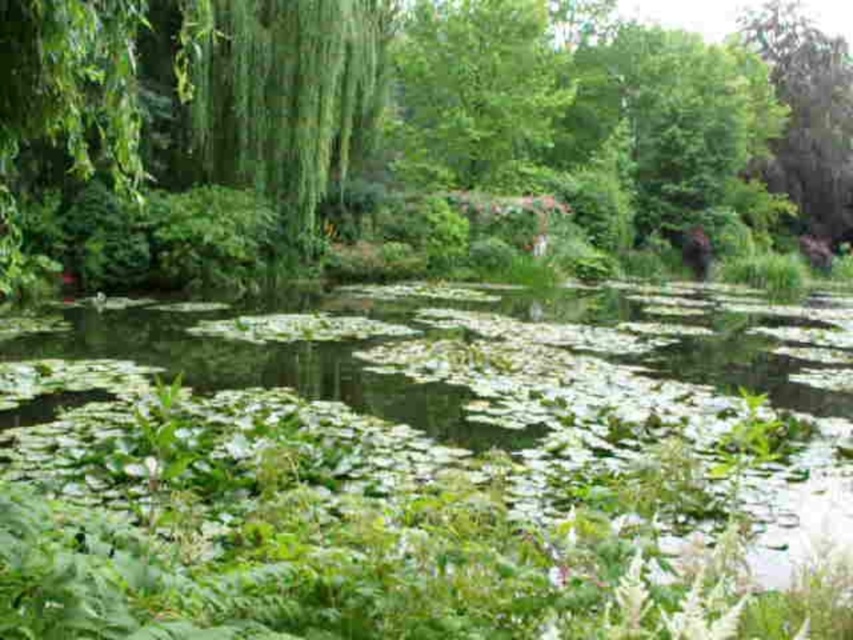
Who is more forward, (32, 349) or (773, 65)?

Point (32, 349) is in front.

I want to click on green leafy water at center, so click(x=538, y=380).

I want to click on green leafy water at center, so click(538, 380).